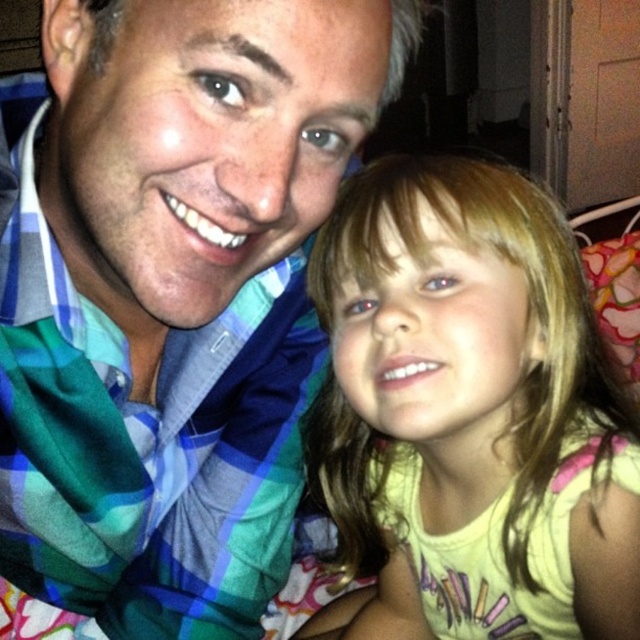
Which of these two, blue plaid shirt at center or yellow cotton shirt at center, stands shorter?

Standing shorter between the two is blue plaid shirt at center.

Which is more to the right, blue plaid shirt at center or yellow cotton shirt at center?

Positioned to the right is yellow cotton shirt at center.

Where is `blue plaid shirt at center`? blue plaid shirt at center is located at coordinates (170, 296).